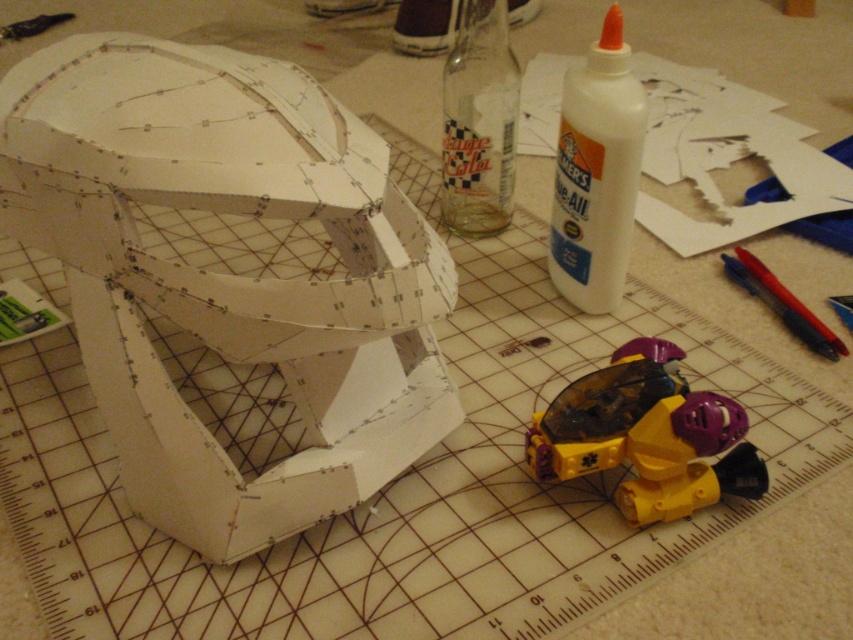
Question: Is white paper helmet at upper left to the right of yellow plastic toy at lower right from the viewer's perspective?

Choices:
 (A) no
 (B) yes

Answer: (A)

Question: Among these objects, which one is farthest from the camera?

Choices:
 (A) yellow plastic toy at lower right
 (B) white paper helmet at upper left

Answer: (A)

Question: Is white paper helmet at upper left above yellow plastic toy at lower right?

Choices:
 (A) yes
 (B) no

Answer: (A)

Question: Is white paper helmet at upper left below yellow plastic toy at lower right?

Choices:
 (A) yes
 (B) no

Answer: (B)

Question: Among these points, which one is farthest from the camera?

Choices:
 (A) (271, 307)
 (B) (706, 420)

Answer: (B)

Question: Among these points, which one is nearest to the camera?

Choices:
 (A) (387, 228)
 (B) (668, 484)

Answer: (A)